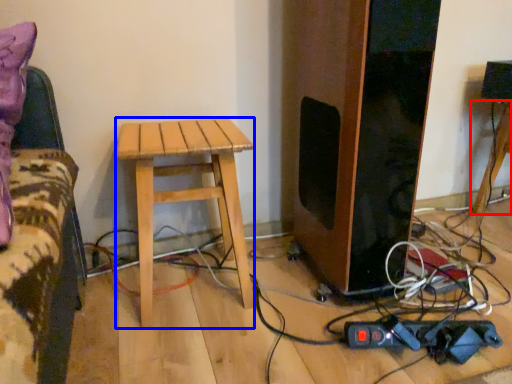
Question: Which object appears closest to the camera in this image, table (highlighted by a red box) or stool (highlighted by a blue box)?

Choices:
 (A) table
 (B) stool

Answer: (B)